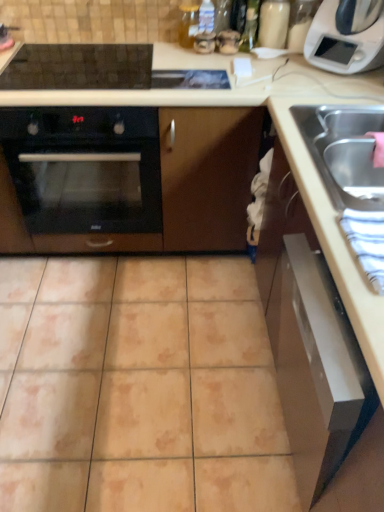
Question: Is beige ceramic tile at center inside satin silver drawer at lower right?

Choices:
 (A) no
 (B) yes

Answer: (A)

Question: Can you confirm if satin silver drawer at lower right is shorter than beige ceramic tile at center?

Choices:
 (A) no
 (B) yes

Answer: (A)

Question: Considering the relative positions of satin silver drawer at lower right and beige ceramic tile at center in the image provided, is satin silver drawer at lower right to the right of beige ceramic tile at center from the viewer's perspective?

Choices:
 (A) no
 (B) yes

Answer: (B)

Question: Does satin silver drawer at lower right come in front of beige ceramic tile at center?

Choices:
 (A) no
 (B) yes

Answer: (B)

Question: From a real-world perspective, is satin silver drawer at lower right below beige ceramic tile at center?

Choices:
 (A) yes
 (B) no

Answer: (B)

Question: From the image's perspective, is satin silver drawer at lower right on top of beige ceramic tile at center?

Choices:
 (A) yes
 (B) no

Answer: (A)

Question: Does satin silver drawer at lower right have a lesser width compared to stainless steel sink at right?

Choices:
 (A) yes
 (B) no

Answer: (B)

Question: Is satin silver drawer at lower right positioned with its back to stainless steel sink at right?

Choices:
 (A) yes
 (B) no

Answer: (B)

Question: Is satin silver drawer at lower right smaller than stainless steel sink at right?

Choices:
 (A) yes
 (B) no

Answer: (B)

Question: Does satin silver drawer at lower right appear on the right side of stainless steel sink at right?

Choices:
 (A) yes
 (B) no

Answer: (B)

Question: From a real-world perspective, is satin silver drawer at lower right beneath stainless steel sink at right?

Choices:
 (A) yes
 (B) no

Answer: (A)

Question: Considering the relative sizes of satin silver drawer at lower right and stainless steel sink at right in the image provided, is satin silver drawer at lower right shorter than stainless steel sink at right?

Choices:
 (A) no
 (B) yes

Answer: (A)

Question: Can black glass oven at left be found inside beige ceramic tile at center?

Choices:
 (A) no
 (B) yes

Answer: (A)